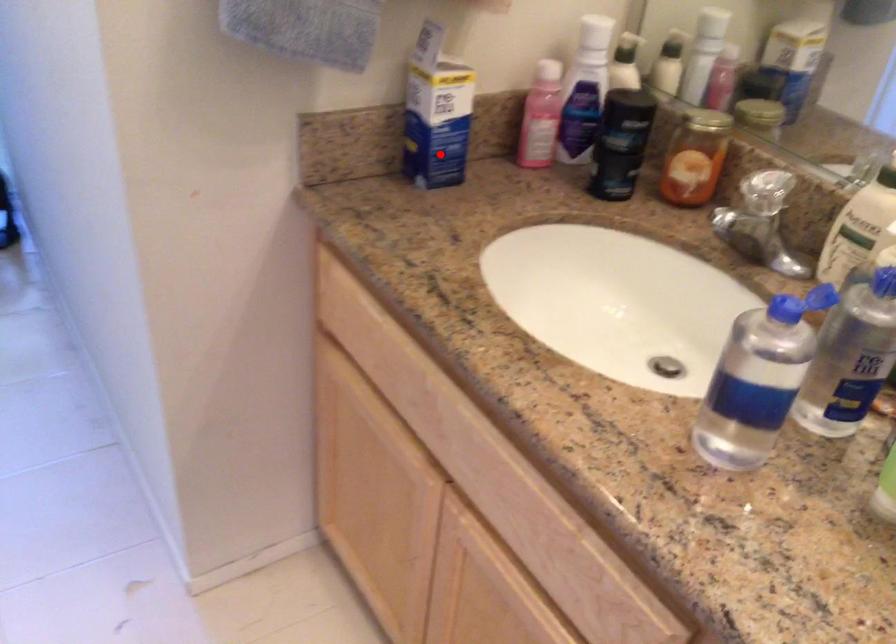
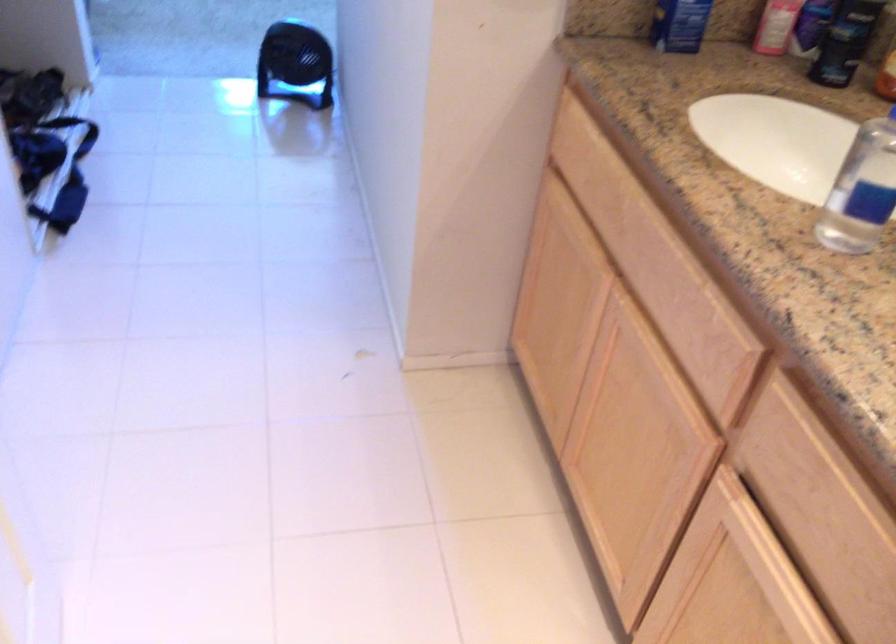
Question: I am providing you with two images of the same scene from different viewpoints. A red point is shown in image1. For the corresponding object point in image2, is it positioned nearer or farther from the camera?

Choices:
 (A) Nearer
 (B) Farther

Answer: (B)